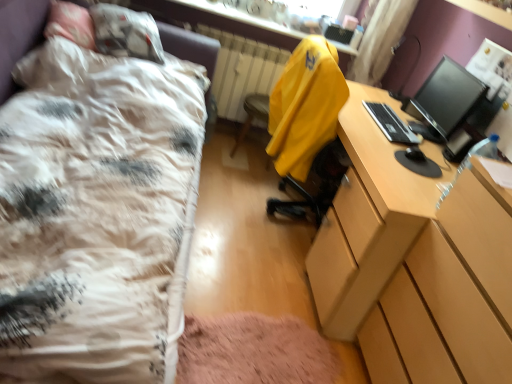
This screenshot has width=512, height=384. Identify the location of blank area beneath black glossy monitor at upper right (from a real-world perspective). (424, 129).